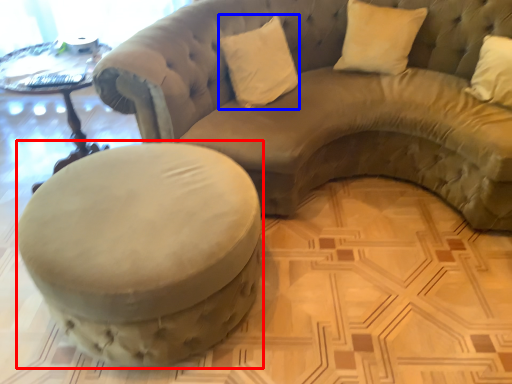
Question: Which object is further to the camera taking this photo, swivel chair (highlighted by a red box) or pillow (highlighted by a blue box)?

Choices:
 (A) swivel chair
 (B) pillow

Answer: (B)